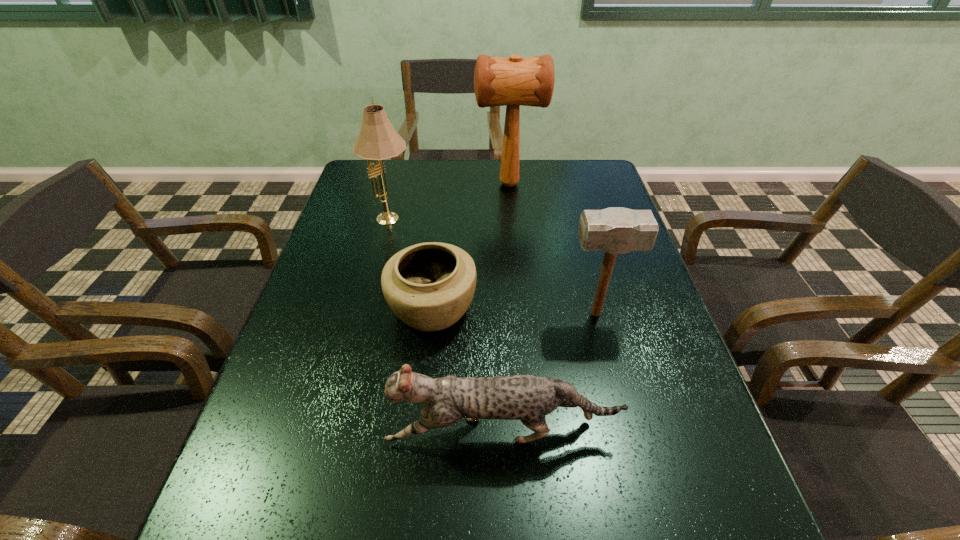
The image size is (960, 540). I want to click on vacant point located between the third shortest object and the pottery, so click(514, 312).

I want to click on vacant space that is in between the shortest object and the fourth tallest object, so click(468, 370).

You are a GUI agent. You are given a task and a screenshot of the screen. Output one action in this format:
    pyautogui.click(x=<x>, y=<y>)
    Task: Click on the free spot between the cat and the farther mallet
    
    Given the screenshot: What is the action you would take?
    pyautogui.click(x=506, y=308)

I want to click on vacant point located between the fourth nearest object and the third tallest object, so click(493, 267).

Identify the location of object that is the fourth nearest to the farthest object. (529, 398).

Identify the location of the closest object to the pottery. Image resolution: width=960 pixels, height=540 pixels. (529, 398).

Identify the location of vacant space that satisfies the following two spatial constraints: 1. on the front side of the shortest object; 2. on the left side of the lampshade. (369, 309).

At what (x,y) coordinates should I click in order to perform the action: click on free location that satisfies the following two spatial constraints: 1. on the front side of the fourth nearest object; 2. on the right side of the pottery. Please return your answer as a coordinate pair (x, y). Looking at the image, I should click on (369, 309).